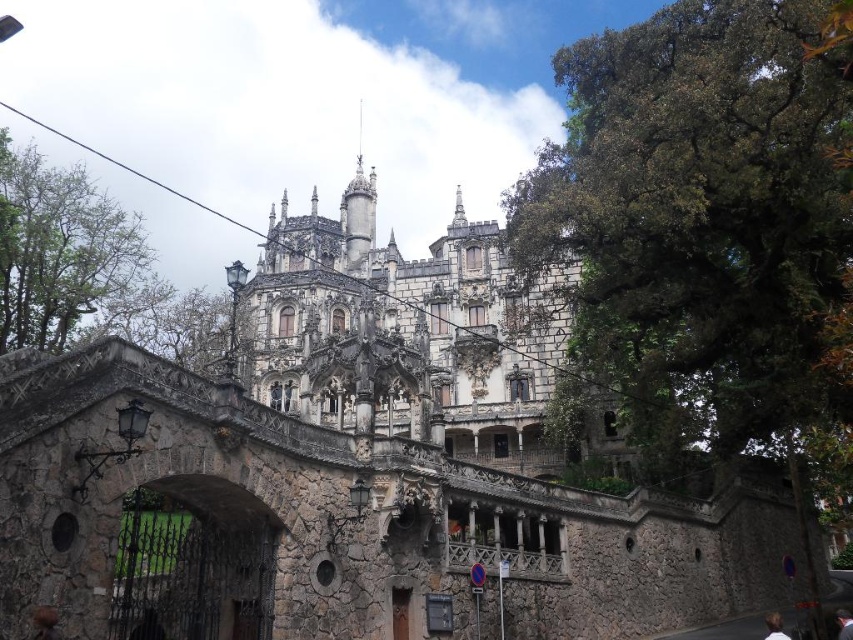
Question: Can you confirm if white hair at lower right is positioned to the right of brown hair at upper center?

Choices:
 (A) yes
 (B) no

Answer: (B)

Question: Which point appears closest to the camera in this image?

Choices:
 (A) (850, 616)
 (B) (772, 637)

Answer: (B)

Question: Is white hair at lower right above brown hair at upper center?

Choices:
 (A) no
 (B) yes

Answer: (A)

Question: Which point is closer to the camera?

Choices:
 (A) (843, 624)
 (B) (776, 618)

Answer: (B)

Question: Observing the image, what is the correct spatial positioning of white hair at lower right in reference to brown hair at upper center?

Choices:
 (A) right
 (B) left

Answer: (B)